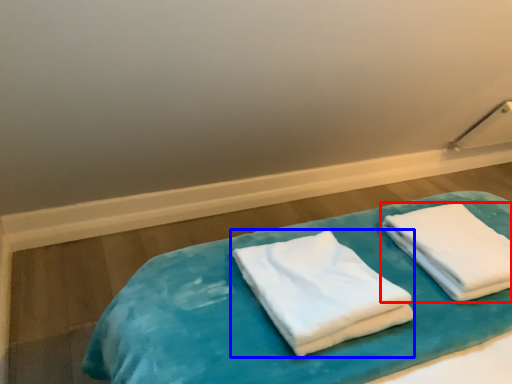
Question: Which object is closer to the camera taking this photo, towel (highlighted by a red box) or towel (highlighted by a blue box)?

Choices:
 (A) towel
 (B) towel

Answer: (B)